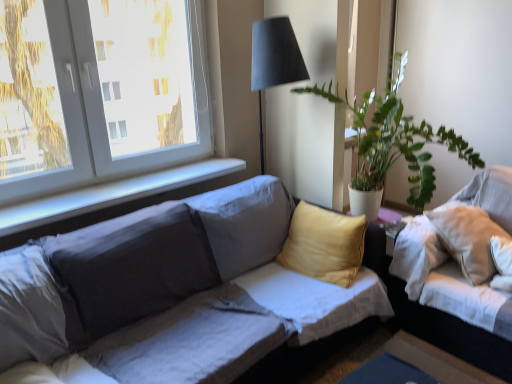
Question: Could white smooth window sill at upper left be considered to be inside white plastic window at upper left?

Choices:
 (A) yes
 (B) no

Answer: (B)

Question: Are white plastic window at upper left and white smooth window sill at upper left making contact?

Choices:
 (A) yes
 (B) no

Answer: (B)

Question: Could you tell me if white plastic window at upper left is facing white smooth window sill at upper left?

Choices:
 (A) yes
 (B) no

Answer: (B)

Question: Considering the relative sizes of white plastic window at upper left and white smooth window sill at upper left in the image provided, is white plastic window at upper left bigger than white smooth window sill at upper left?

Choices:
 (A) yes
 (B) no

Answer: (A)

Question: Considering the relative sizes of white plastic window at upper left and white smooth window sill at upper left in the image provided, is white plastic window at upper left wider than white smooth window sill at upper left?

Choices:
 (A) no
 (B) yes

Answer: (A)

Question: Relative to white smooth window sill at upper left, is white fabric couch at right, marked as the 2th studio couch in a left-to-right arrangement, in front or behind?

Choices:
 (A) front
 (B) behind

Answer: (A)

Question: Considering the positions of white fabric couch at right, the 1th studio couch positioned from the right, and white smooth window sill at upper left in the image, is white fabric couch at right, the 1th studio couch positioned from the right, taller or shorter than white smooth window sill at upper left?

Choices:
 (A) short
 (B) tall

Answer: (B)

Question: From the image's perspective, relative to white smooth window sill at upper left, is white fabric couch at right, the 1th studio couch positioned from the right, above or below?

Choices:
 (A) below
 (B) above

Answer: (A)

Question: Is white fabric couch at right, the 1th studio couch positioned from the right, inside or outside of white smooth window sill at upper left?

Choices:
 (A) outside
 (B) inside

Answer: (A)

Question: Looking at their shapes, would you say white fabric couch at right, marked as the 2th studio couch in a left-to-right arrangement, is wider or thinner than white plastic window at upper left?

Choices:
 (A) thin
 (B) wide

Answer: (B)

Question: From their relative heights in the image, would you say white fabric couch at right, the 1th studio couch positioned from the right, is taller or shorter than white plastic window at upper left?

Choices:
 (A) tall
 (B) short

Answer: (B)

Question: Considering their positions, is white fabric couch at right, marked as the 2th studio couch in a left-to-right arrangement, located in front of or behind white plastic window at upper left?

Choices:
 (A) behind
 (B) front

Answer: (B)

Question: From the image's perspective, is white fabric couch at right, marked as the 2th studio couch in a left-to-right arrangement, above or below white plastic window at upper left?

Choices:
 (A) above
 (B) below

Answer: (B)

Question: From a real-world perspective, is matte gray couch at center, the first studio couch viewed from the left, positioned above or below white fabric couch at right, marked as the 2th studio couch in a left-to-right arrangement?

Choices:
 (A) below
 (B) above

Answer: (A)

Question: Is matte gray couch at center, the second studio couch positioned from the right, inside or outside of white fabric couch at right, marked as the 2th studio couch in a left-to-right arrangement?

Choices:
 (A) outside
 (B) inside

Answer: (A)